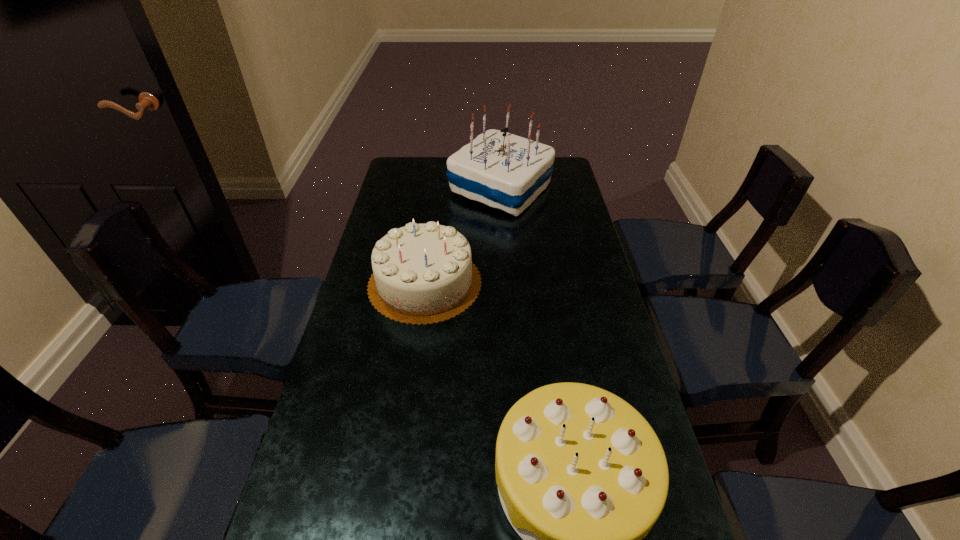
Image resolution: width=960 pixels, height=540 pixels. What are the coordinates of `free spot at the right edge of the desktop` in the screenshot? It's located at (556, 229).

Where is `object that stands as the second closest to the tallest object`? This screenshot has width=960, height=540. object that stands as the second closest to the tallest object is located at coordinates (582, 477).

Image resolution: width=960 pixels, height=540 pixels. I want to click on object that is the second closest one to the tallest object, so click(x=582, y=477).

Identify which birthday cake is the nearest to the tallest birthday cake. Please provide its 2D coordinates. Your answer should be formatted as a tuple, i.e. [(x, y)], where the tuple contains the x and y coordinates of a point satisfying the conditions above.

[(423, 274)]

Identify the location of birthday cake identified as the closest to the nearest object. (423, 274).